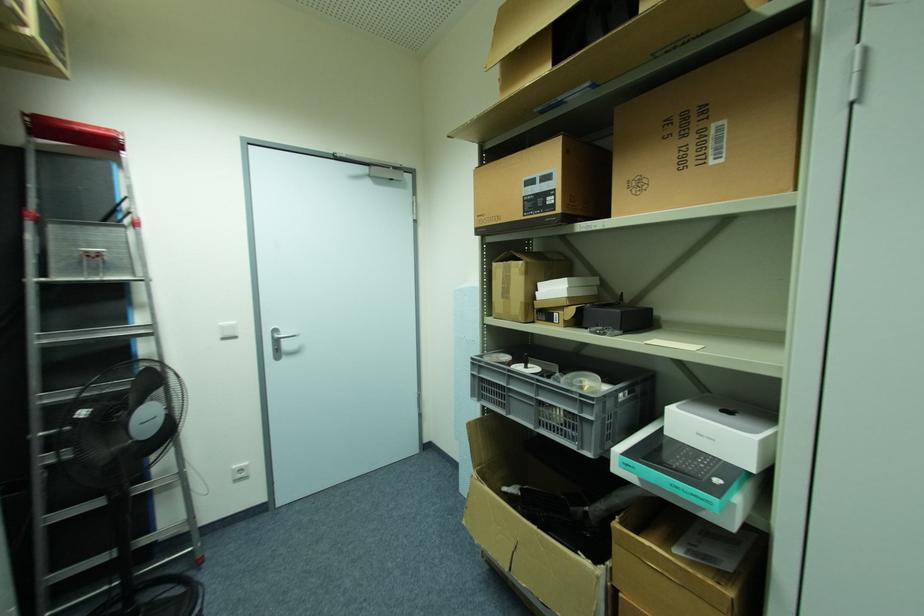
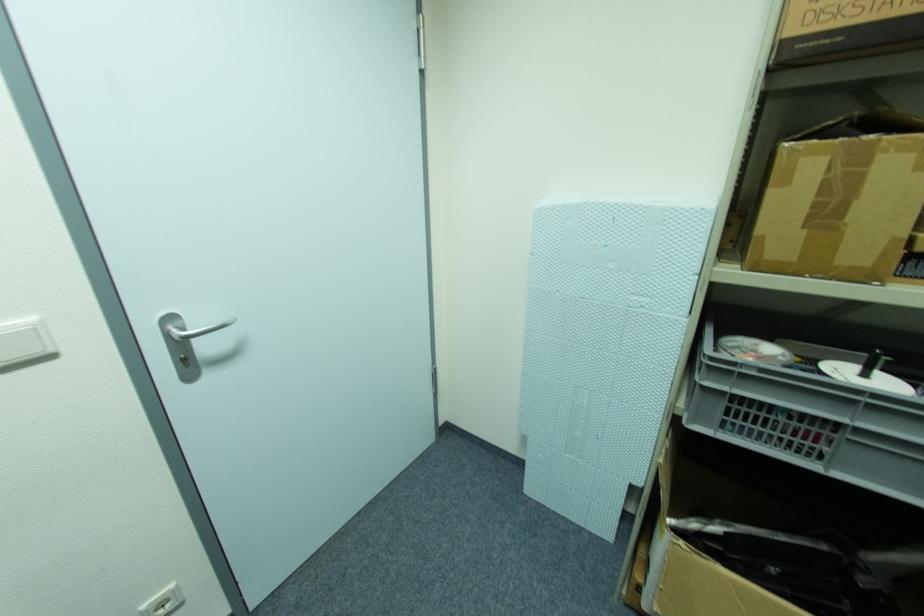
The point at (508, 270) is marked in the first image. Where is the corresponding point in the second image?

(859, 159)